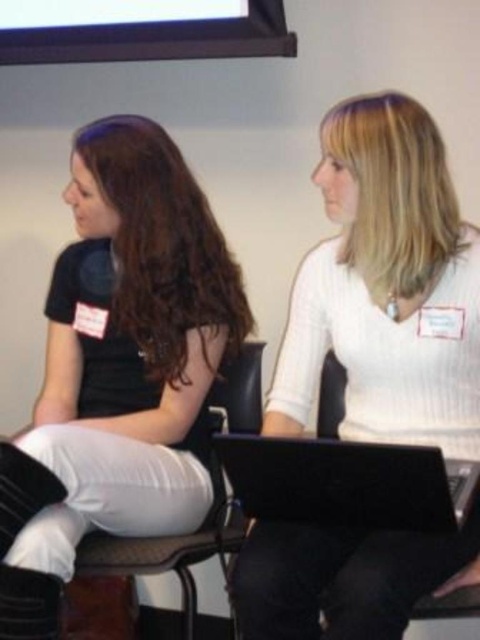
Does white ribbed sweater at center lie behind black leather chair at center?

No, white ribbed sweater at center is closer to the viewer.

Between white ribbed sweater at center and black leather chair at center, which one has more height?

white ribbed sweater at center

Which is behind, point (297, 636) or point (253, 371)?

Point (253, 371)

Image resolution: width=480 pixels, height=640 pixels. Find the location of `white ribbed sweater at center`. white ribbed sweater at center is located at coordinates (386, 288).

Is white ribbed sweater at center positioned behind matte black shirt at left?

No, white ribbed sweater at center is closer to the viewer.

Does white ribbed sweater at center appear on the left side of matte black shirt at left?

Incorrect, white ribbed sweater at center is not on the left side of matte black shirt at left.

Who is more forward, (415, 230) or (159, 516)?

Positioned in front is point (415, 230).

The height and width of the screenshot is (640, 480). Identify the location of white ribbed sweater at center. (386, 288).

The height and width of the screenshot is (640, 480). I want to click on matte black shirt at left, so click(120, 365).

Does matte black shirt at left have a smaller size compared to black plastic chair at lower center?

No, matte black shirt at left is not smaller than black plastic chair at lower center.

Is point (112, 125) behind point (455, 577)?

Yes, point (112, 125) is behind point (455, 577).

What are the coordinates of `matte black shirt at left` in the screenshot? It's located at (120, 365).